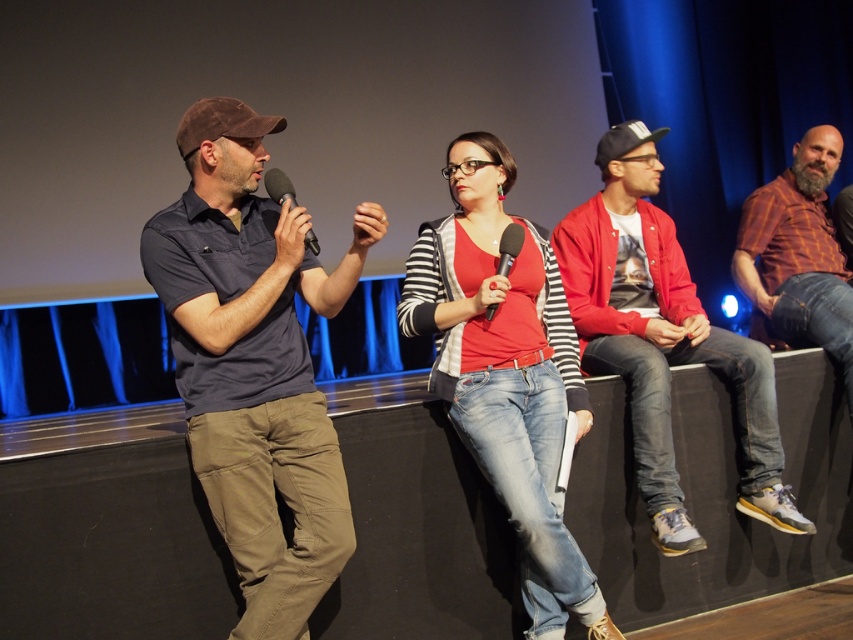
Question: Which of the following is the farthest from the observer?

Choices:
 (A) dark blue cotton shirt at left
 (B) plaid shirt at right
 (C) black matte microphone at upper left

Answer: (B)

Question: Is matte red shirt at center thinner than black matte microphone at center?

Choices:
 (A) yes
 (B) no

Answer: (B)

Question: Which object is positioned closest to the red cotton jacket at right?

Choices:
 (A) black matte microphone at upper left
 (B) black matte microphone at center
 (C) dark blue cotton shirt at left
 (D) plaid shirt at right

Answer: (D)

Question: Can you confirm if red cotton jacket at right is wider than black matte microphone at upper left?

Choices:
 (A) no
 (B) yes

Answer: (B)

Question: In this image, where is red cotton jacket at right located relative to black matte microphone at center?

Choices:
 (A) right
 (B) left

Answer: (A)

Question: Which of the following is the closest to the observer?

Choices:
 (A) plaid shirt at right
 (B) black matte microphone at upper left
 (C) matte red shirt at center
 (D) dark blue cotton shirt at left

Answer: (B)